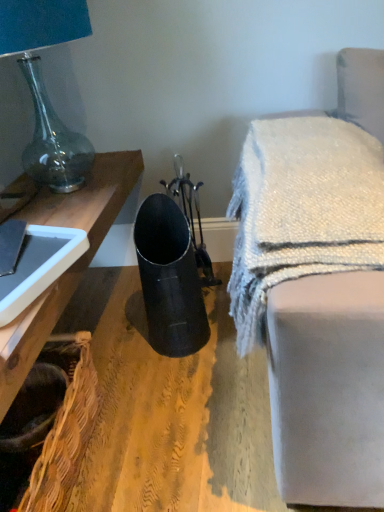
This screenshot has width=384, height=512. Describe the element at coordinates (45, 87) in the screenshot. I see `teal glass lamp at upper left` at that location.

What do you see at coordinates (65, 432) in the screenshot? This screenshot has width=384, height=512. I see `woven brown basket at lower left` at bounding box center [65, 432].

Where is `white textured blanket at upper right`? The image size is (384, 512). white textured blanket at upper right is located at coordinates tap(315, 301).

You are a GUI agent. You are given a task and a screenshot of the screen. Output one action in this format:
    pyautogui.click(x=<x>, y=<y>)
    Task: Click on the teal glass lamp at upper left
    This screenshot has width=384, height=512.
    Given the screenshot: What is the action you would take?
    pyautogui.click(x=45, y=87)

Is white textured blanket at upper right thinner than woven brown basket at lower left?

No.

Does white textured blanket at upper right have a smaller size compared to woven brown basket at lower left?

Actually, white textured blanket at upper right might be larger than woven brown basket at lower left.

From a real-world perspective, which is physically below, white textured blanket at upper right or woven brown basket at lower left?

woven brown basket at lower left.

From the image's perspective, which object appears higher, white textured blanket at upper right or woven brown basket at lower left?

white textured blanket at upper right is shown above in the image.

Is white textured blanket at upper right to the left or to the right of teal glass lamp at upper left in the image?

white textured blanket at upper right is positioned on teal glass lamp at upper left's right side.

Who is taller, white textured blanket at upper right or teal glass lamp at upper left?

With more height is teal glass lamp at upper left.

Considering the points (295, 298) and (29, 85), which point is in front, point (295, 298) or point (29, 85)?

The point (295, 298) is closer.

From the picture: Based on their sizes in the image, would you say white textured blanket at upper right is bigger or smaller than teal glass lamp at upper left?

Considering their sizes, white textured blanket at upper right takes up less space than teal glass lamp at upper left.

From the image's perspective, is teal glass lamp at upper left positioned above or below woven brown basket at lower left?

teal glass lamp at upper left is situated higher than woven brown basket at lower left in the image.

Does point (28, 40) come closer to viewer compared to point (65, 469)?

No, it is not.

Considering the positions of objects teal glass lamp at upper left and woven brown basket at lower left in the image provided, who is more to the right, teal glass lamp at upper left or woven brown basket at lower left?

From the viewer's perspective, woven brown basket at lower left appears more on the right side.

Who is taller, teal glass lamp at upper left or white textured blanket at upper right?

Standing taller between the two is teal glass lamp at upper left.

How many degrees apart are the facing directions of teal glass lamp at upper left and white textured blanket at upper right?

The angle between the facing direction of teal glass lamp at upper left and the facing direction of white textured blanket at upper right is 96.7 degrees.

In the scene shown: Is teal glass lamp at upper left looking in the opposite direction of white textured blanket at upper right?

No, white textured blanket at upper right is not at the back of teal glass lamp at upper left.

From a real-world perspective, is woven brown basket at lower left positioned under teal glass lamp at upper left based on gravity?

Yes, from a real-world perspective, woven brown basket at lower left is below teal glass lamp at upper left.

Is point (90, 435) positioned after point (92, 160)?

No.

Considering their positions, is woven brown basket at lower left located in front of or behind teal glass lamp at upper left?

Visually, woven brown basket at lower left is located in front of teal glass lamp at upper left.

Considering the points (48, 452) and (367, 347), which point is behind, point (48, 452) or point (367, 347)?

The point (48, 452) is more distant.

Who is bigger, woven brown basket at lower left or white textured blanket at upper right?

With larger size is white textured blanket at upper right.

How many degrees apart are the facing directions of woven brown basket at lower left and white textured blanket at upper right?

They differ by 96.3 degrees in their facing directions.

Is woven brown basket at lower left taller or shorter than white textured blanket at upper right?

In the image, woven brown basket at lower left appears to be shorter than white textured blanket at upper right.

Where is `furniture above the woven brown basket at lower left (from a real-world perspective)`? furniture above the woven brown basket at lower left (from a real-world perspective) is located at coordinates (315, 301).

The image size is (384, 512). I want to click on lamp lying above the white textured blanket at upper right (from the image's perspective), so click(45, 87).

When comparing their distances from teal glass lamp at upper left, does woven brown basket at lower left or white textured blanket at upper right seem closer?

woven brown basket at lower left.

Looking at this image, which object lies further to the anchor point white textured blanket at upper right, teal glass lamp at upper left or woven brown basket at lower left?

Among the two, teal glass lamp at upper left is located further to white textured blanket at upper right.

Looking at the image, which one is located closer to teal glass lamp at upper left, white textured blanket at upper right or woven brown basket at lower left?

Among the two, woven brown basket at lower left is located nearer to teal glass lamp at upper left.

Which object lies further to the anchor point woven brown basket at lower left, white textured blanket at upper right or teal glass lamp at upper left?

teal glass lamp at upper left.

Looking at the image, which one is located closer to woven brown basket at lower left, teal glass lamp at upper left or white textured blanket at upper right?

Based on the image, white textured blanket at upper right appears to be nearer to woven brown basket at lower left.

Estimate the real-world distances between objects in this image. Which object is further from white textured blanket at upper right, woven brown basket at lower left or teal glass lamp at upper left?

teal glass lamp at upper left lies further to white textured blanket at upper right than the other object.

Find the location of `furniture between teal glass lamp at upper left and woven brown basket at lower left from top to bottom`. furniture between teal glass lamp at upper left and woven brown basket at lower left from top to bottom is located at coordinates (315, 301).